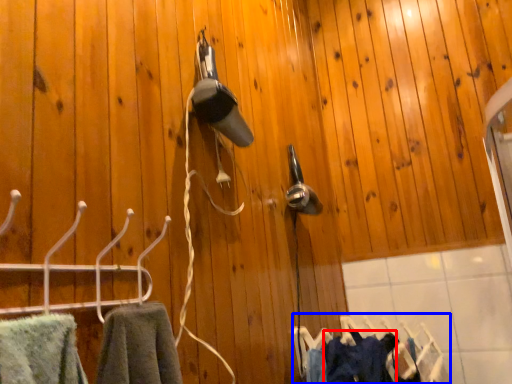
Question: Which object appears closest to the camera in this image, clothing (highlighted by a red box) or laundry (highlighted by a blue box)?

Choices:
 (A) clothing
 (B) laundry

Answer: (A)